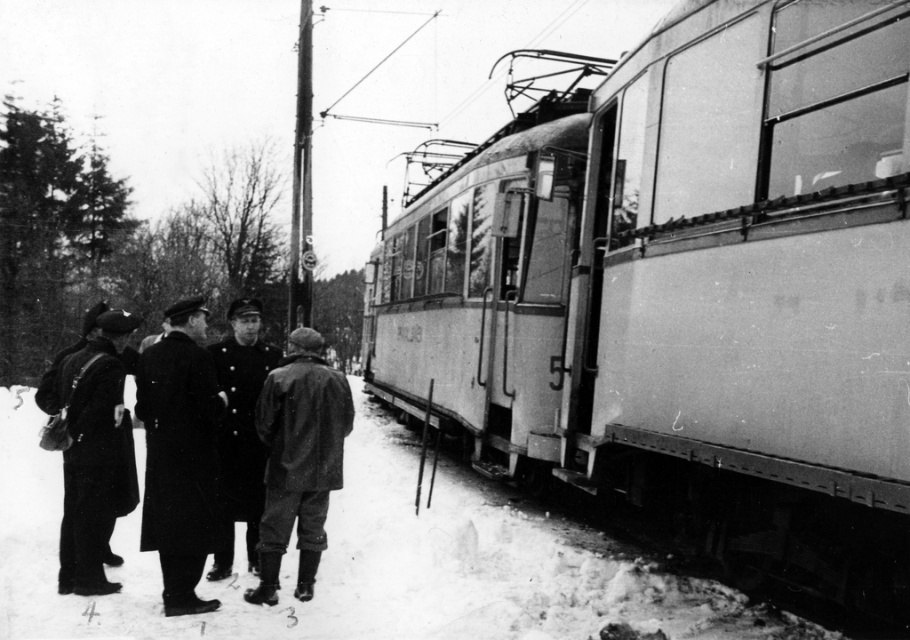
You are a photographer trying to capture a wide shot of the smooth metal train at right and the uniformed man at center. Based on their sizes, which object would appear smaller in the photo?

The smooth metal train at right would appear smaller in the photo because it has a lesser width compared to the uniformed man at center.

You are a photographer standing in the snowy scene and want to take a photo of the matte black coat at left and the uniformed man at center. Which object is positioned lower in the image?

The matte black coat at left is located below the uniformed man at center, so it is positioned lower in the image.

You are standing at the point with coordinates [94,454] in the snowy outdoor scene. What object is located exactly at this point?

The matte black coat at left is located exactly at point [94,454].